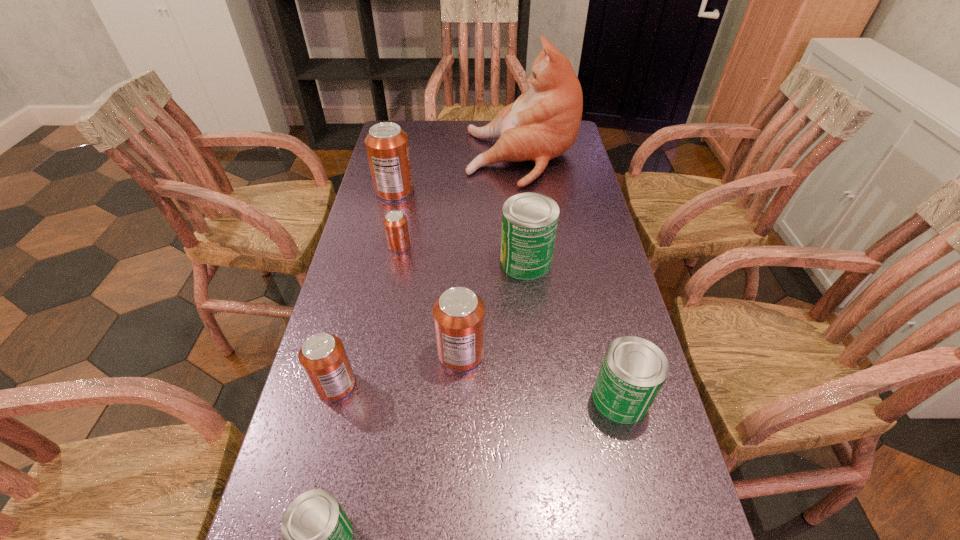
This screenshot has width=960, height=540. I want to click on vacant region located 0.060m on the back of the smallest orange can, so click(403, 225).

You are a GUI agent. You are given a task and a screenshot of the screen. Output one action in this format:
    pyautogui.click(x=<x>, y=<y>)
    Task: Click on the object located at the far edge
    
    Given the screenshot: What is the action you would take?
    pyautogui.click(x=543, y=123)

This screenshot has height=540, width=960. Identify the location of cat that is at the right edge. (543, 123).

Identify the location of can that is at the right edge. The image size is (960, 540). (633, 370).

Locate an element on the screen. object that is at the far right corner is located at coordinates (543, 123).

Where is `blank space at the left edge`? blank space at the left edge is located at coordinates (346, 490).

Identify the location of vacant region at the right edge. (588, 340).

Locate an element on the screen. free space between the tallest object and the second tallest object is located at coordinates (458, 174).

Identify the location of free area in between the third biggest orange can and the farthest green can. This screenshot has width=960, height=540. (431, 323).

The height and width of the screenshot is (540, 960). I want to click on vacant region between the orange cat and the second smallest green can, so click(x=571, y=278).